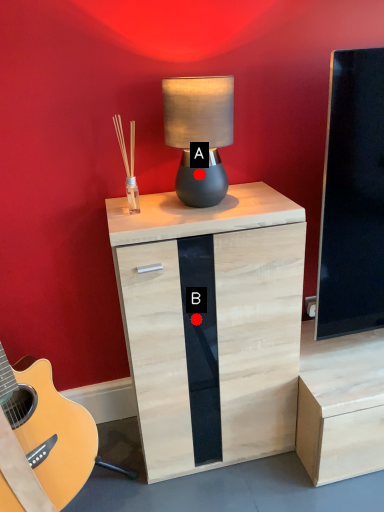
Question: Two points are circled on the image, labeled by A and B beside each circle. Which of the following is the closest to the observer?

Choices:
 (A) A is closer
 (B) B is closer

Answer: (A)